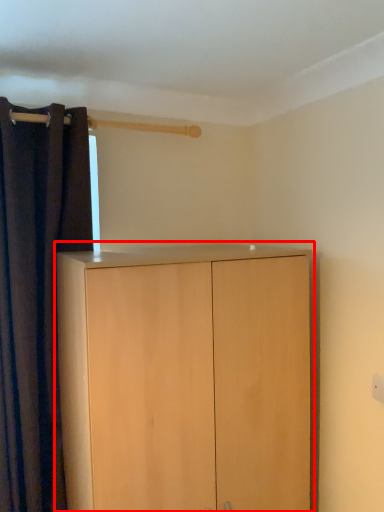
Question: From the image's perspective, considering the relative positions of cupboard (annotated by the red box) and curtain in the image provided, where is cupboard (annotated by the red box) located with respect to the staircase?

Choices:
 (A) above
 (B) below

Answer: (B)